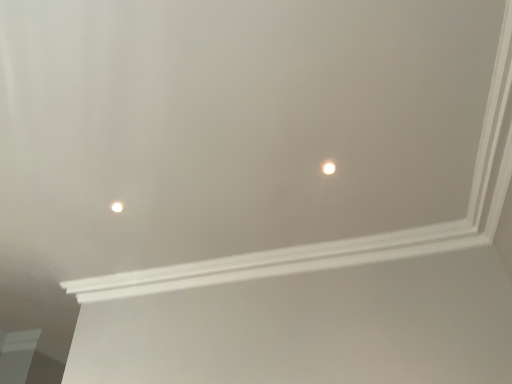
Question: From the image's perspective, is matte white light at upper left, the second light viewed from the right, above or below white glossy light at upper center, acting as the second light starting from the left?

Choices:
 (A) below
 (B) above

Answer: (A)

Question: In the image, is matte white light at upper left, marked as the 2th light in a top-to-bottom arrangement, positioned in front of or behind white glossy light at upper center, acting as the second light starting from the left?

Choices:
 (A) front
 (B) behind

Answer: (B)

Question: Is matte white light at upper left, the second light viewed from the right, wider or thinner than white glossy light at upper center, the 1th light viewed from the top?

Choices:
 (A) wide
 (B) thin

Answer: (B)

Question: From the image's perspective, is white glossy light at upper center, which is the 2th light in bottom-to-top order, located above or below matte white light at upper left, which is counted as the 1th light, starting from the back?

Choices:
 (A) above
 (B) below

Answer: (A)

Question: In terms of height, does white glossy light at upper center, acting as the second light starting from the left, look taller or shorter compared to matte white light at upper left, marked as the 2th light in a top-to-bottom arrangement?

Choices:
 (A) short
 (B) tall

Answer: (A)

Question: Considering the positions of point (326, 163) and point (120, 208), is point (326, 163) closer or farther from the camera than point (120, 208)?

Choices:
 (A) farther
 (B) closer

Answer: (B)

Question: Considering their positions, is white glossy light at upper center, acting as the second light starting from the left, located in front of or behind matte white light at upper left, marked as the 1th light in a bottom-to-top arrangement?

Choices:
 (A) front
 (B) behind

Answer: (A)